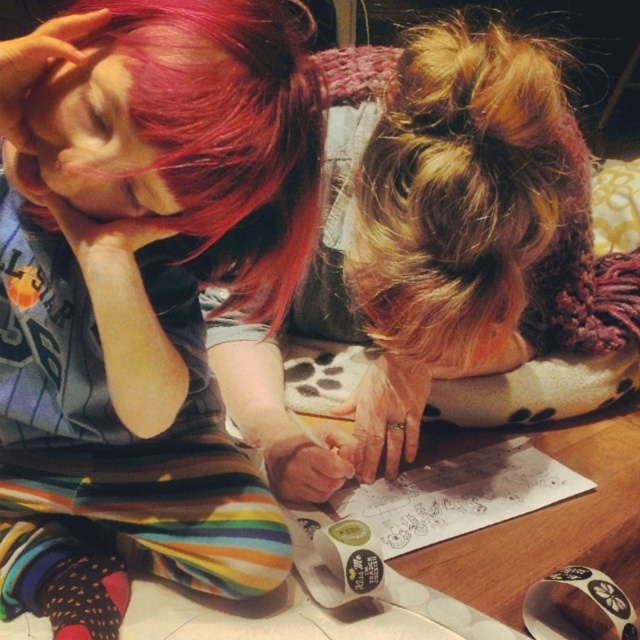
You are standing in front of the image and want to locate the matte black shirt at center. Based on the coordinates given, where would you find it?

The matte black shirt at center is located at coordinates point (141,292).

You are designing a layout for a magazine cover and need to place two elements based on their sizes. The matte black shirt at center and the blonde hair bun at upper center are the elements. Which element should you choose if you want to place a larger element in the upper part of the cover?

The blonde hair bun at upper center should be placed in the upper part of the cover since it occupies more space than the matte black shirt at center according to the description.